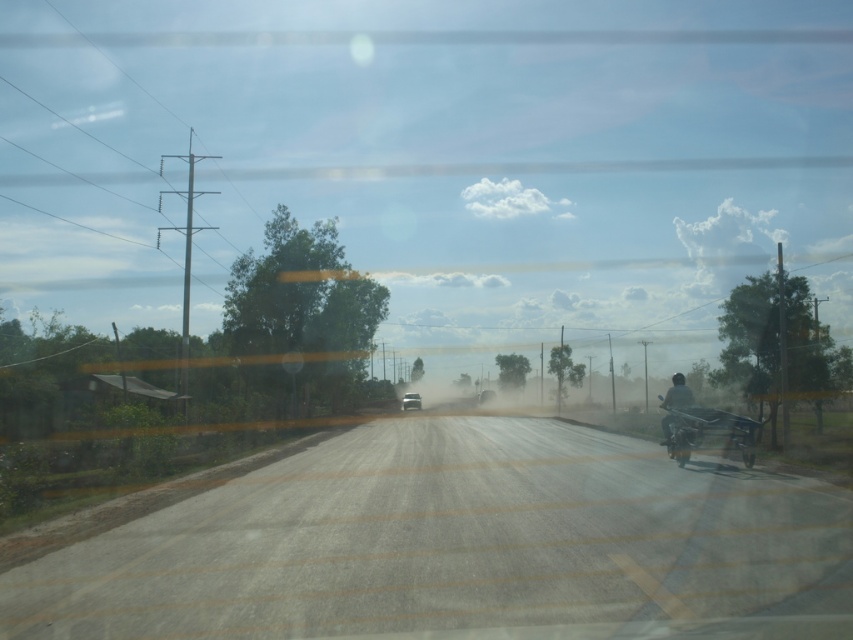
Who is positioned more to the right, shiny black motorcycle at right or metallic silver car at center?

From the viewer's perspective, shiny black motorcycle at right appears more on the right side.

Is shiny black motorcycle at right below metallic silver car at center?

Actually, shiny black motorcycle at right is above metallic silver car at center.

In the scene shown: Who is more forward, (668,406) or (412,404)?

Point (668,406)

The height and width of the screenshot is (640, 853). What are the coordinates of `shiny black motorcycle at right` in the screenshot? It's located at [x=679, y=422].

Who is more forward, (682, 397) or (672, 401)?

Positioned in front is point (682, 397).

Locate an element on the screen. This screenshot has height=640, width=853. shiny black motorcycle at right is located at coordinates (679, 422).

Is dark matte motorbike at right to the left of shiny black motorcycle at right from the viewer's perspective?

No, dark matte motorbike at right is not to the left of shiny black motorcycle at right.

This screenshot has height=640, width=853. What do you see at coordinates (701, 426) in the screenshot?
I see `dark matte motorbike at right` at bounding box center [701, 426].

Find the location of a particular element. The height and width of the screenshot is (640, 853). dark matte motorbike at right is located at coordinates (701, 426).